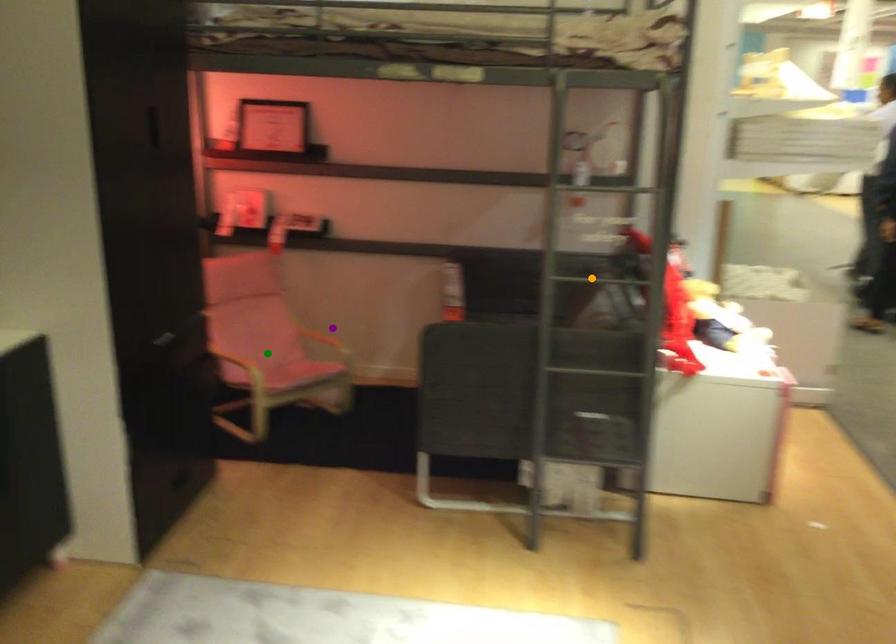
Order these from nearest to farthest:
A) green point
B) orange point
C) purple point

orange point → green point → purple point